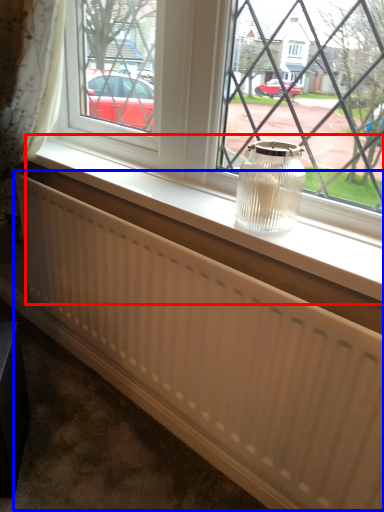
Question: Which object appears farthest to the camera in this image, window sill (highlighted by a red box) or radiator (highlighted by a blue box)?

Choices:
 (A) window sill
 (B) radiator

Answer: (A)